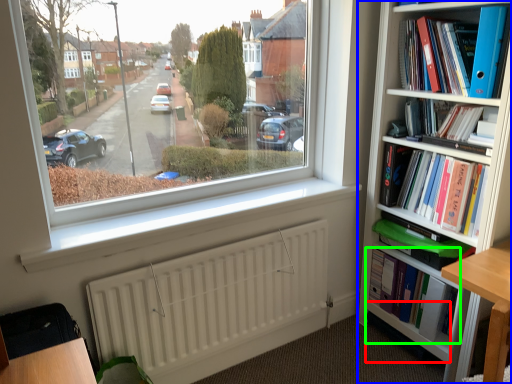
Question: Based on their relative distances, which object is farther from shelf (highlighted by a red box)? Choose from bookcase (highlighted by a blue box) and book (highlighted by a green box).

Choices:
 (A) bookcase
 (B) book

Answer: (A)